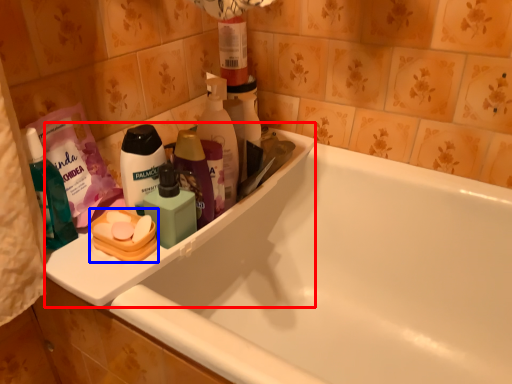
Question: Which point is further to the camera, sink (highlighted by a red box) or personal care (highlighted by a blue box)?

Choices:
 (A) sink
 (B) personal care

Answer: (B)